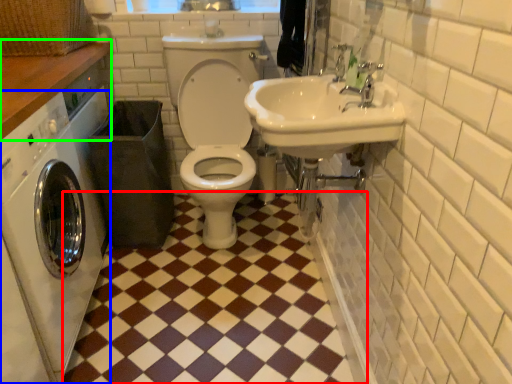
Question: Based on their relative distances, which object is nearer to ceramic tile (highlighted by a red box)? Choose from washing machine (highlighted by a blue box) and counter top (highlighted by a green box).

Choices:
 (A) washing machine
 (B) counter top

Answer: (A)